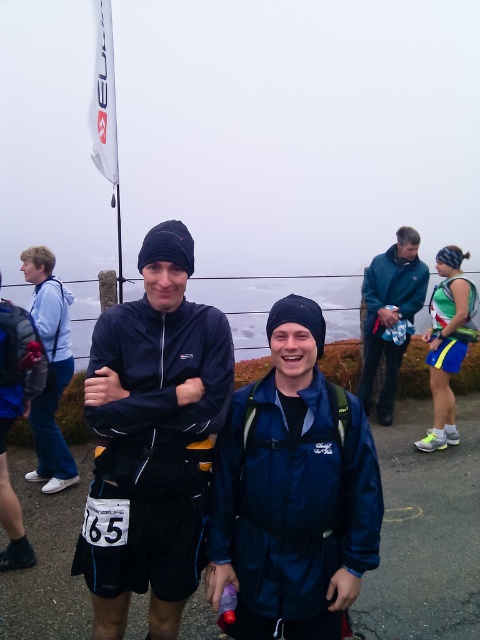
Which is more to the left, teal fabric jacket at center or matte blue jacket at left?

matte blue jacket at left is more to the left.

Can you confirm if teal fabric jacket at center is taller than matte blue jacket at left?

Yes.

Which is in front, point (383, 278) or point (36, 323)?

Point (36, 323) is in front.

You are a GUI agent. You are given a task and a screenshot of the screen. Output one action in this format:
    pyautogui.click(x=<x>, y=<y>)
    Task: Click on the teal fabric jacket at center
    This screenshot has width=480, height=640.
    Given the screenshot: What is the action you would take?
    pyautogui.click(x=389, y=316)

Is navy blue jacket at center to the right of matte blue jacket at left from the viewer's perspective?

Indeed, navy blue jacket at center is positioned on the right side of matte blue jacket at left.

Is navy blue jacket at center to the left of matte blue jacket at left from the viewer's perspective?

No, navy blue jacket at center is not to the left of matte blue jacket at left.

Where is `navy blue jacket at center`? navy blue jacket at center is located at coordinates (292, 492).

Between navy blue jacket at center and green fabric skirt at lower right, which one has more height?

Standing taller between the two is green fabric skirt at lower right.

Is point (283, 504) positioned in front of point (444, 369)?

Yes.

Identify the location of navy blue jacket at center. This screenshot has height=640, width=480. (292, 492).